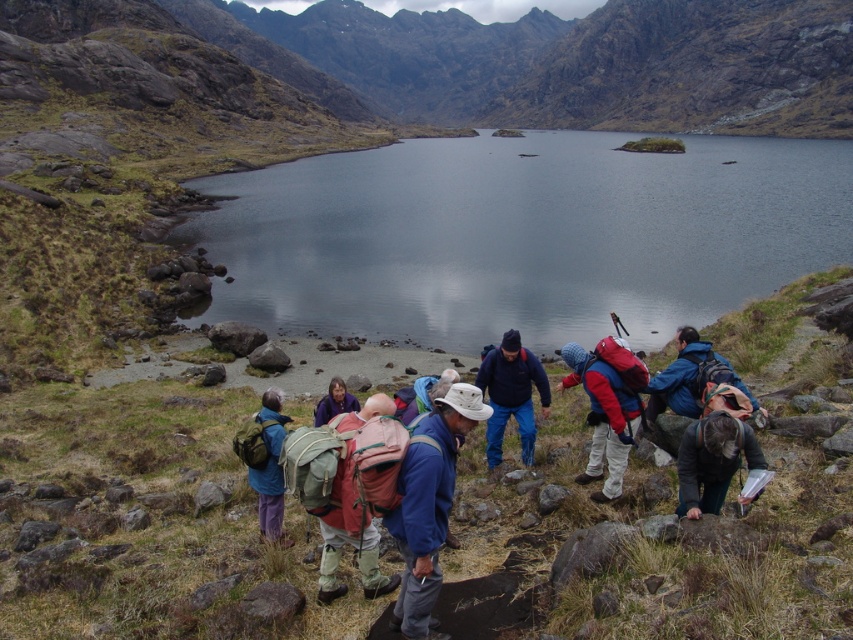
You are a hiker who wants to cross the lake using a small inflatable raft that can hold up to 200 kg. You notice the smooth reflective water at center and the matte pink backpack at center. Which object is bigger and can you safely place the backpack on the raft without exceeding the weight limit?

The smooth reflective water at center is bigger than the matte pink backpack at center. However, the backpack is lightweight, so placing it on the raft won let you exceed the weight limit. You can safely put the matte pink backpack at center on the raft.

You are a hiker who just arrived at the lake and need to place your red backpack at center. Where should you put it?

You should place your red backpack at center at point (602, 417).